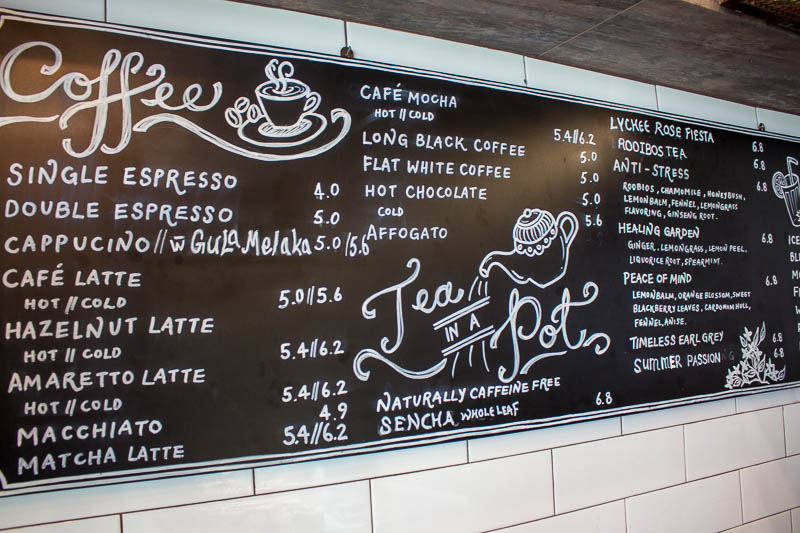
You are a GUI agent. You are given a task and a screenshot of the screen. Output one action in this format:
    pyautogui.click(x=<x>, y=<y>)
    Task: Click on the handle
    
    Given the screenshot: What is the action you would take?
    pyautogui.click(x=312, y=102), pyautogui.click(x=581, y=219)